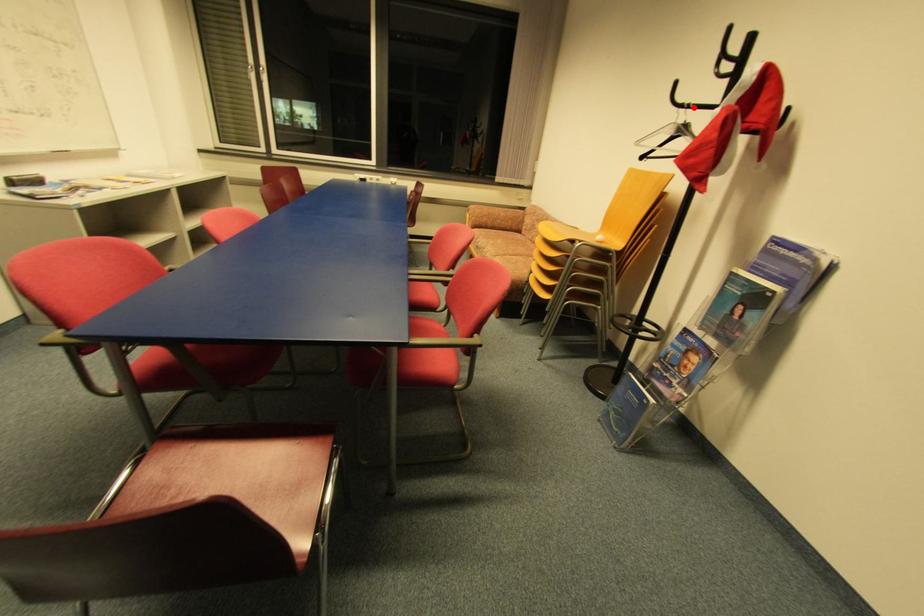
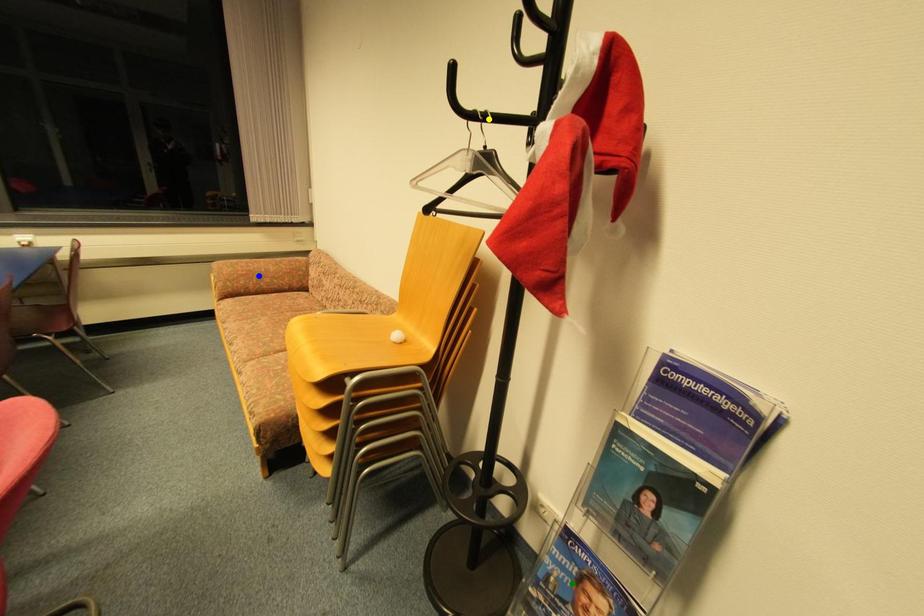
Question: I am providing you with two images of the same scene from different viewpoints. A red point is marked on the first image. You are given multiple points on the second image. Which point in image 2 is actually the same real-world point as the red point in image 1?

Choices:
 (A) yellow point
 (B) green point
 (C) blue point

Answer: (A)